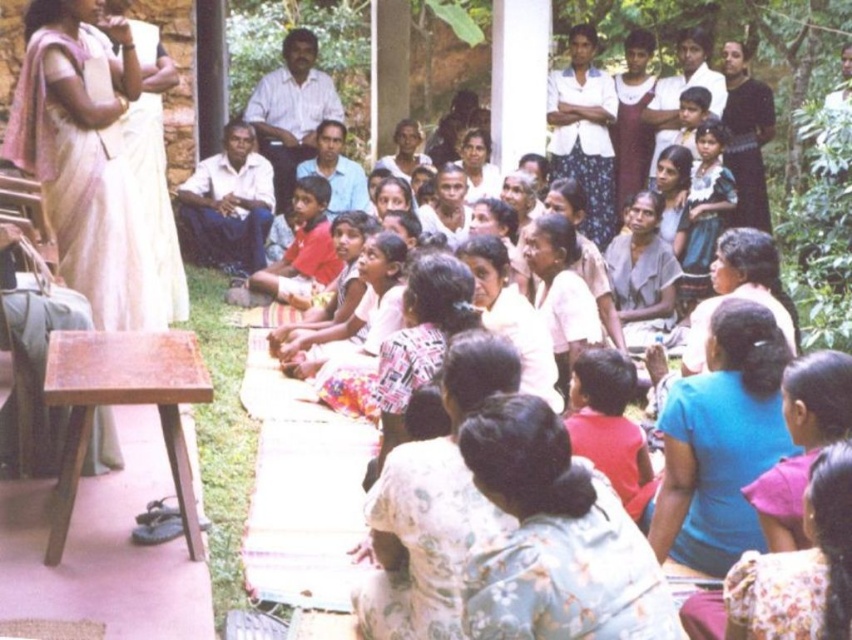
Question: Does floral fabric dress at center have a smaller size compared to white cotton shirt at center?

Choices:
 (A) yes
 (B) no

Answer: (B)

Question: Which object appears closest to the camera in this image?

Choices:
 (A) white cotton shirt at center
 (B) floral fabric dress at center

Answer: (B)

Question: Does floral fabric dress at center appear on the right side of white cotton shirt at center?

Choices:
 (A) no
 (B) yes

Answer: (A)

Question: Which point is farther to the camera?

Choices:
 (A) blue fabric shirt at lower right
 (B) floral fabric dress at center

Answer: (A)

Question: Which point appears farthest from the camera in this image?

Choices:
 (A) (695, 394)
 (B) (568, 532)

Answer: (A)

Question: Does floral fabric dress at center have a lesser width compared to white cotton shirt at center?

Choices:
 (A) yes
 (B) no

Answer: (B)